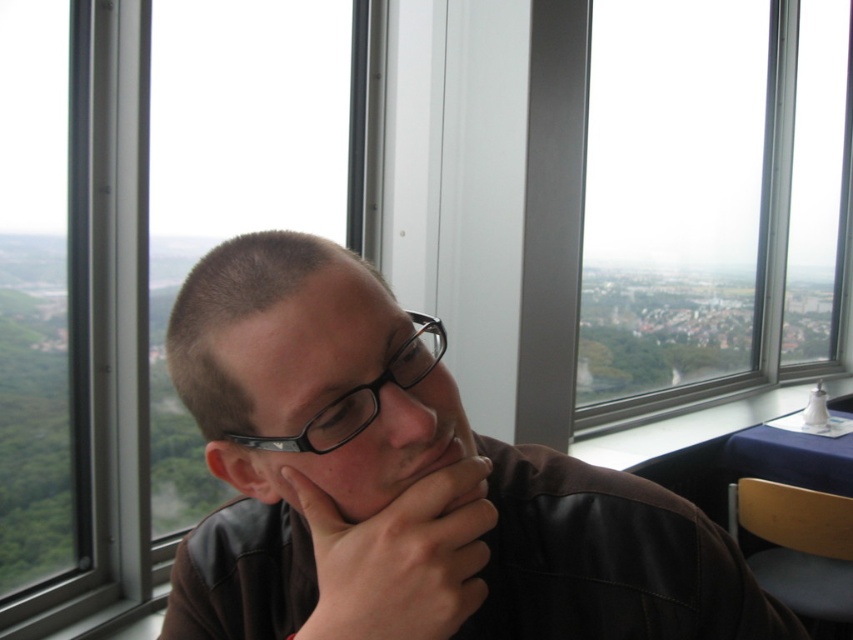
You are an interior designer assessing the placement of objects in a room. You notice the matte black jacket at center and the matte black jaw at center. Which object is positioned to the left when viewed from the front?

The matte black jacket at center is positioned to the left of the matte black jaw at center.

You are a fashion designer observing the scene. You notice the matte black jacket at center and the dark brown leather hand at center. Which object is located lower in the image?

The matte black jacket at center is positioned under the dark brown leather hand at center, so the matte black jacket at center is lower.

You are a photographer trying to capture a clear shot of the person in the image. The black plastic glasses at center and the matte black jaw at center are both in your viewfinder. Which object should you focus on to ensure the glasses are sharp and in focus?

You should focus on the black plastic glasses at center because it is in front of the matte black jaw at center, so focusing on the glasses will keep them sharp while the jaw may appear slightly out of focus.